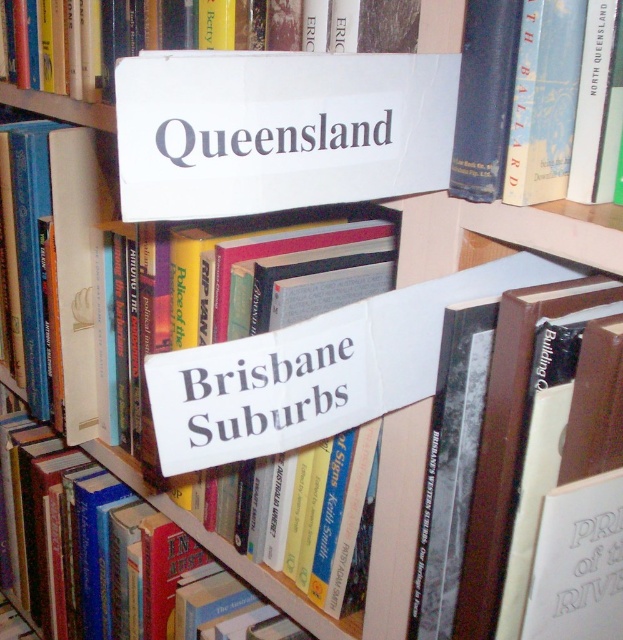
Can you confirm if blue hardcover book at upper right is wider than white paper sign at center?

No, blue hardcover book at upper right is not wider than white paper sign at center.

This screenshot has width=623, height=640. What are the coordinates of `blue hardcover book at upper right` in the screenshot? It's located at (566, 102).